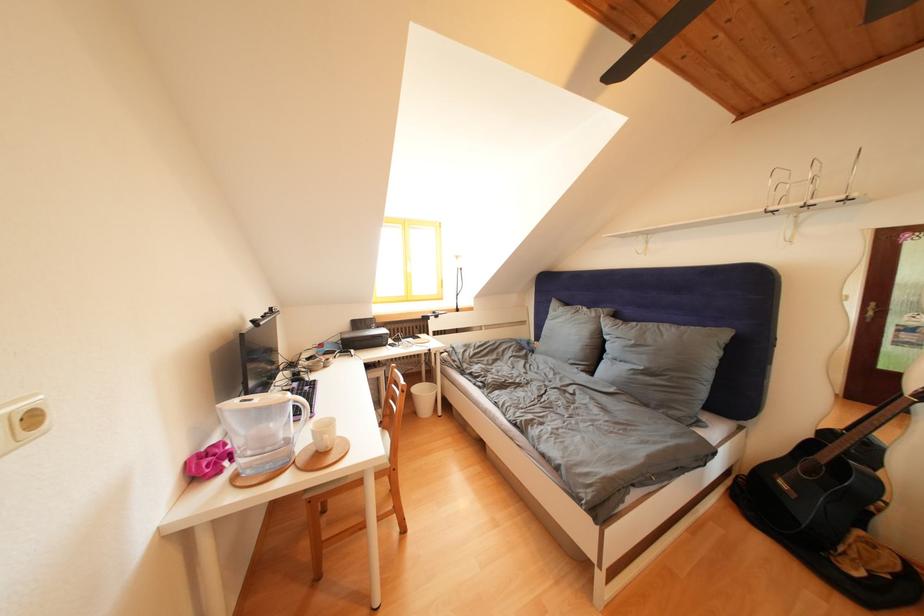
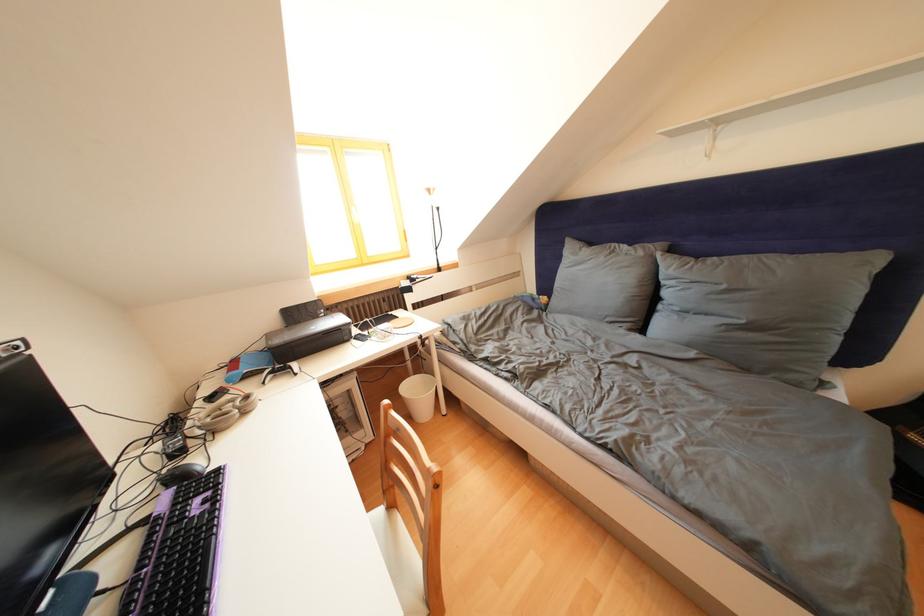
The point at (602, 320) is marked in the first image. Where is the corresponding point in the second image?

(649, 259)